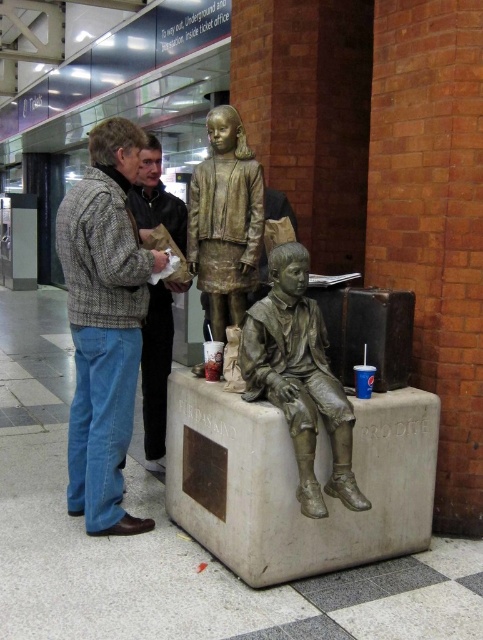
Question: Which point is closer to the camera?

Choices:
 (A) light brown leather jacket at center
 (B) bronze statue at upper center
 (C) bronze statue at center
 (D) gray wool sweater at left

Answer: (C)

Question: Which point is farther to the camera?

Choices:
 (A) (107, 332)
 (B) (284, 308)

Answer: (A)

Question: Can you confirm if bronze statue at center is smaller than bronze statue at upper center?

Choices:
 (A) no
 (B) yes

Answer: (A)

Question: Is gray wool sweater at left below bronze statue at center?

Choices:
 (A) no
 (B) yes

Answer: (A)

Question: Can you confirm if bronze statue at center is positioned to the left of bronze statue at upper center?

Choices:
 (A) yes
 (B) no

Answer: (B)

Question: Which point is closer to the camera taking this photo?

Choices:
 (A) (154, 460)
 (B) (206, 122)
 (C) (109, 422)
 (D) (337, 483)

Answer: (D)